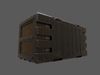
Find the location of `shiny spot at top of chest`. shiny spot at top of chest is located at coordinates (40, 13), (43, 13), (46, 15).